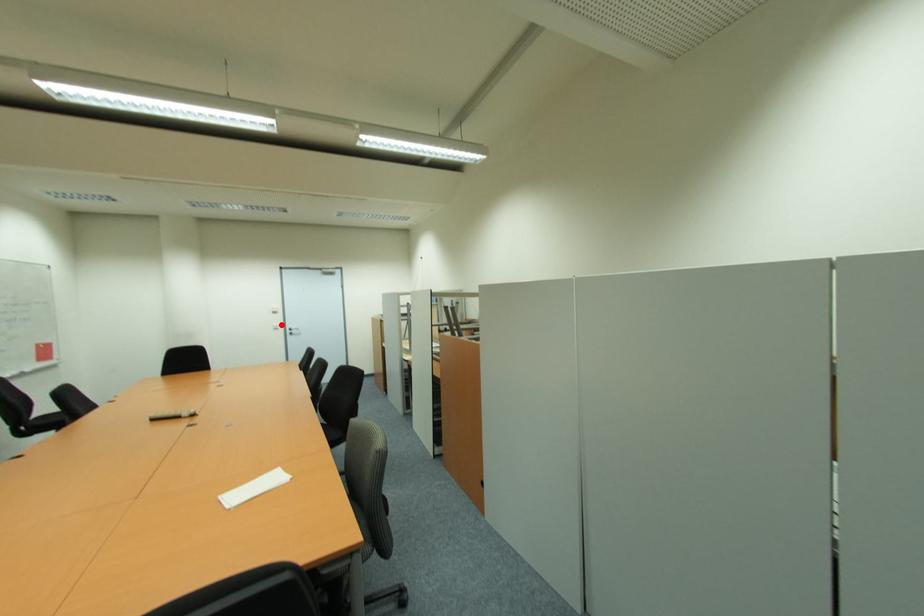
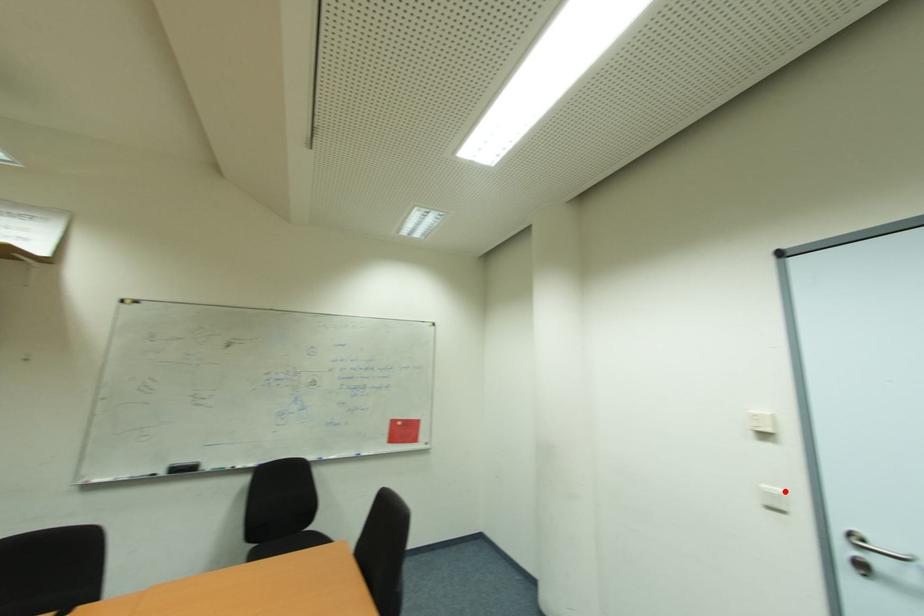
I am providing you with two images of the same scene from different viewpoints. A red point is marked on the first image and another point is marked on the second image. Is the red point in image1 aligned with the point shown in image2?

Yes